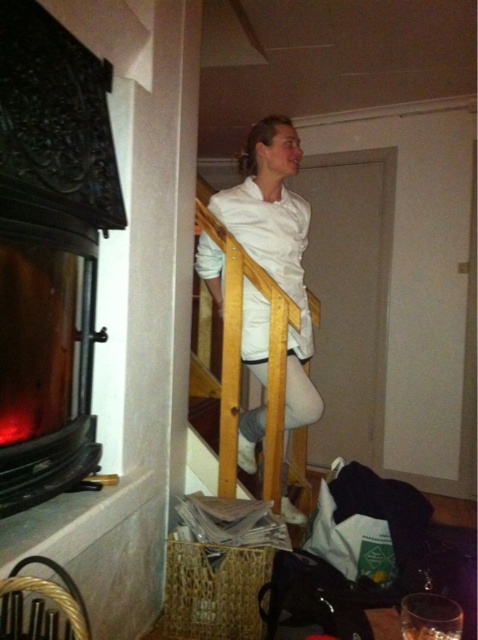
Question: Does matte black fireplace at left come in front of white matte shirt at center?

Choices:
 (A) no
 (B) yes

Answer: (B)

Question: Which object appears farthest from the camera in this image?

Choices:
 (A) white matte shirt at center
 (B) matte black fireplace at left

Answer: (A)

Question: Is matte black fireplace at left above white matte shirt at center?

Choices:
 (A) no
 (B) yes

Answer: (A)

Question: Can you confirm if matte black fireplace at left is positioned below white matte shirt at center?

Choices:
 (A) no
 (B) yes

Answer: (B)